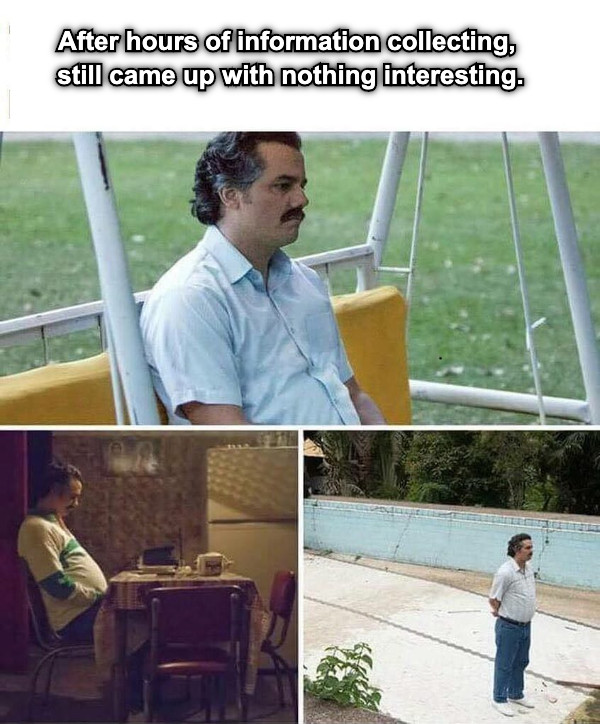
Where is `table leg`? table leg is located at coordinates (118, 636).